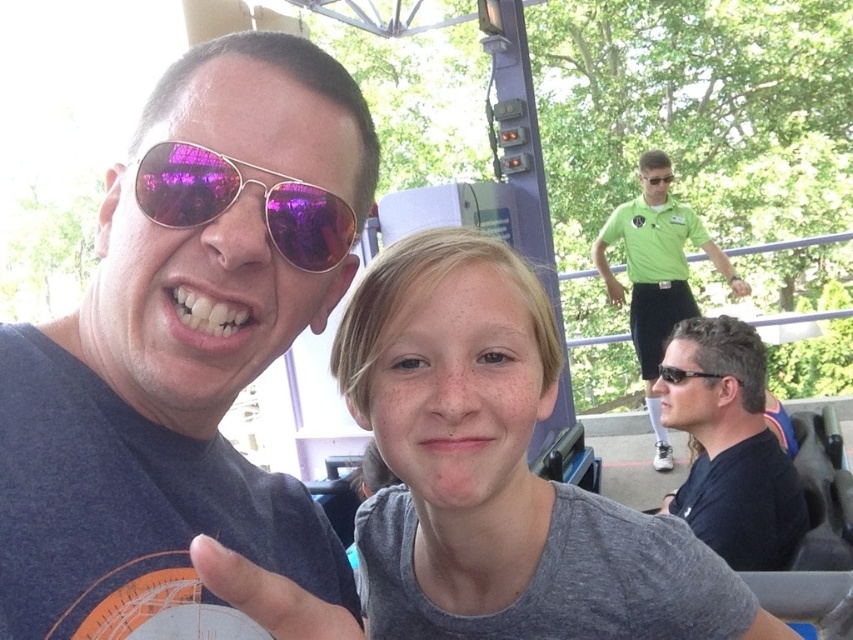
Between point (346, 228) and point (611, 577), which one is positioned behind?

Point (611, 577)

Which is more to the right, matte black sunglasses at upper left or gray matte shirt at center?

gray matte shirt at center

Which is behind, point (206, 522) or point (375, 545)?

The point (375, 545) is more distant.

This screenshot has width=853, height=640. I want to click on matte black sunglasses at upper left, so click(187, 365).

Can you confirm if green fabric shirt at upper right is shorter than matte green sunglasses at upper right?

No, green fabric shirt at upper right is not shorter than matte green sunglasses at upper right.

Consider the image. Is green fabric shirt at upper right positioned behind matte green sunglasses at upper right?

No.

In order to click on green fabric shirt at upper right in this screenshot , I will do `click(656, 282)`.

The height and width of the screenshot is (640, 853). I want to click on green fabric shirt at upper right, so click(656, 282).

Can you confirm if metallic aviator sunglasses at left is smaller than matte green sunglasses at upper right?

Indeed, metallic aviator sunglasses at left has a smaller size compared to matte green sunglasses at upper right.

Does metallic aviator sunglasses at left have a lesser height compared to matte green sunglasses at upper right?

Yes, metallic aviator sunglasses at left is shorter than matte green sunglasses at upper right.

Which is behind, point (354, 230) or point (656, 170)?

Point (656, 170)

Locate an element on the screen. metallic aviator sunglasses at left is located at coordinates (236, 198).